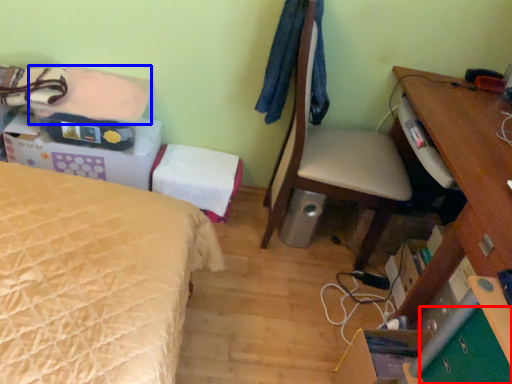
Question: Which object appears closest to the camera in this image, drawer (highlighted by a red box) or sheet (highlighted by a blue box)?

Choices:
 (A) drawer
 (B) sheet

Answer: (A)